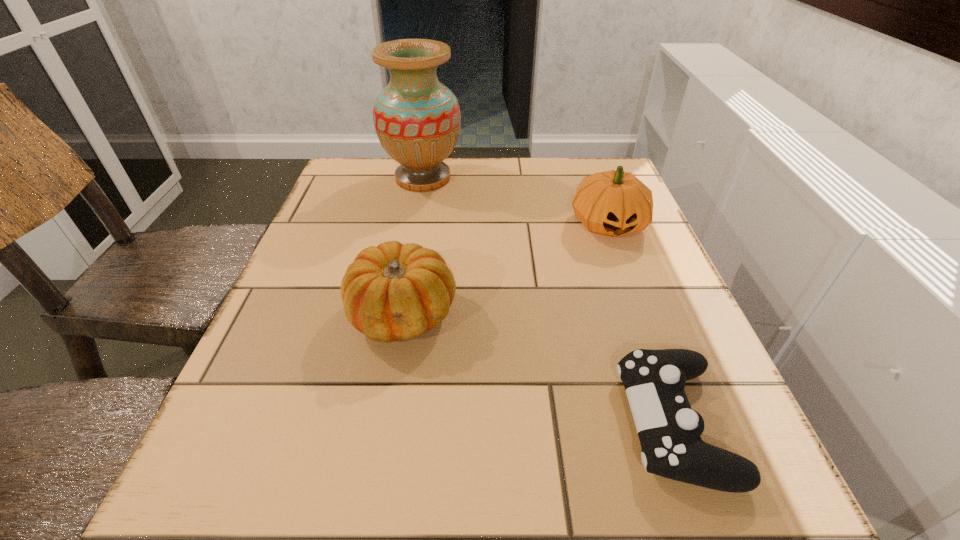
The width and height of the screenshot is (960, 540). In order to click on control that is positioned at the right edge in this screenshot , I will do `click(669, 430)`.

Locate an element on the screen. The image size is (960, 540). object positioned at the far left corner is located at coordinates (417, 119).

The width and height of the screenshot is (960, 540). I want to click on object that is at the far right corner, so click(613, 203).

At what (x,y) coordinates should I click in order to perform the action: click on object that is at the near right corner. Please return your answer as a coordinate pair (x, y). The width and height of the screenshot is (960, 540). Looking at the image, I should click on (669, 430).

Identify the location of blank space at the far edge of the desktop. This screenshot has height=540, width=960. (538, 202).

Find the location of `vacant position at the near edge of the desktop`. vacant position at the near edge of the desktop is located at coordinates (547, 497).

Locate an element on the screen. free space at the left edge is located at coordinates (298, 285).

This screenshot has height=540, width=960. In order to click on free space at the right edge of the desktop in this screenshot , I will do `click(642, 347)`.

This screenshot has height=540, width=960. I want to click on free region at the far left corner, so click(337, 182).

Image resolution: width=960 pixels, height=540 pixels. In the image, there is a desktop. Identify the location of free space at the far right corner. (578, 159).